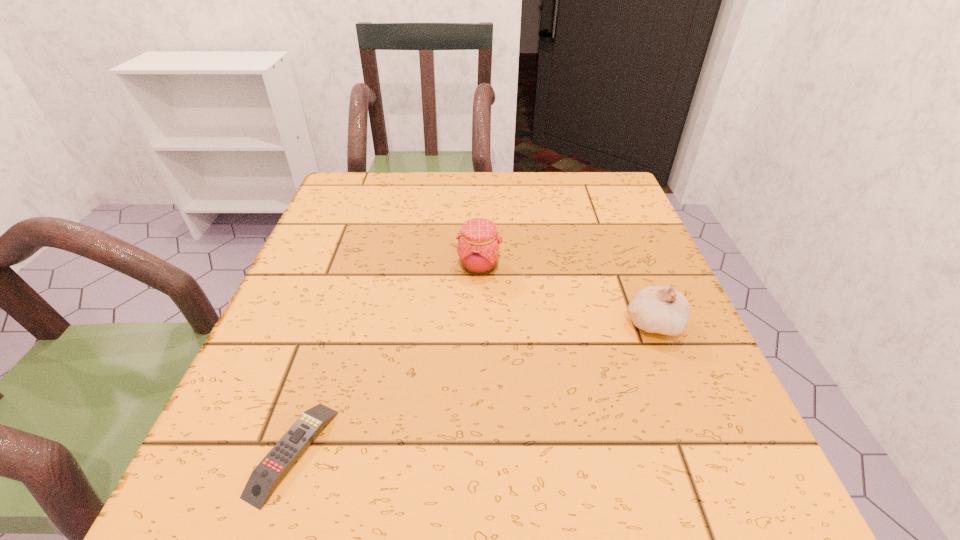
This screenshot has width=960, height=540. I want to click on the farthest object, so click(478, 248).

Image resolution: width=960 pixels, height=540 pixels. What are the coordinates of `jam` in the screenshot? It's located at (478, 248).

The height and width of the screenshot is (540, 960). Find the location of `the rightmost object`. the rightmost object is located at coordinates (663, 310).

Where is `the second farthest object`? the second farthest object is located at coordinates (663, 310).

Locate an element on the screen. This screenshot has height=540, width=960. the nearest object is located at coordinates (263, 480).

The width and height of the screenshot is (960, 540). Find the location of `the shortest object`. the shortest object is located at coordinates (263, 480).

You are a GUI agent. You are given a task and a screenshot of the screen. Output one action in this format:
    pyautogui.click(x=<x>, y=<y>)
    Task: Click on the blank area located 0.070m on the left of the second object from right to left
    Image resolution: width=960 pixels, height=540 pixels.
    Given the screenshot: What is the action you would take?
    (422, 267)

The height and width of the screenshot is (540, 960). Find the location of `vacant space located on the left of the garlic`. vacant space located on the left of the garlic is located at coordinates (532, 324).

This screenshot has height=540, width=960. Find the location of `free space located on the back of the leftmost object`. free space located on the back of the leftmost object is located at coordinates (349, 283).

I want to click on object located at the near edge, so click(x=263, y=480).